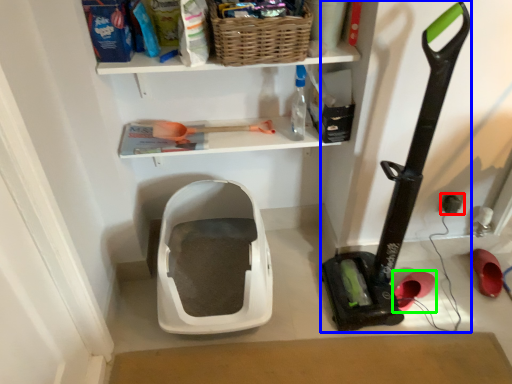
Question: Considering the real-world distances, which object is closest to electric outlet (highlighted by a red box)? equipment (highlighted by a blue box) or footwear (highlighted by a green box).

Choices:
 (A) equipment
 (B) footwear

Answer: (B)